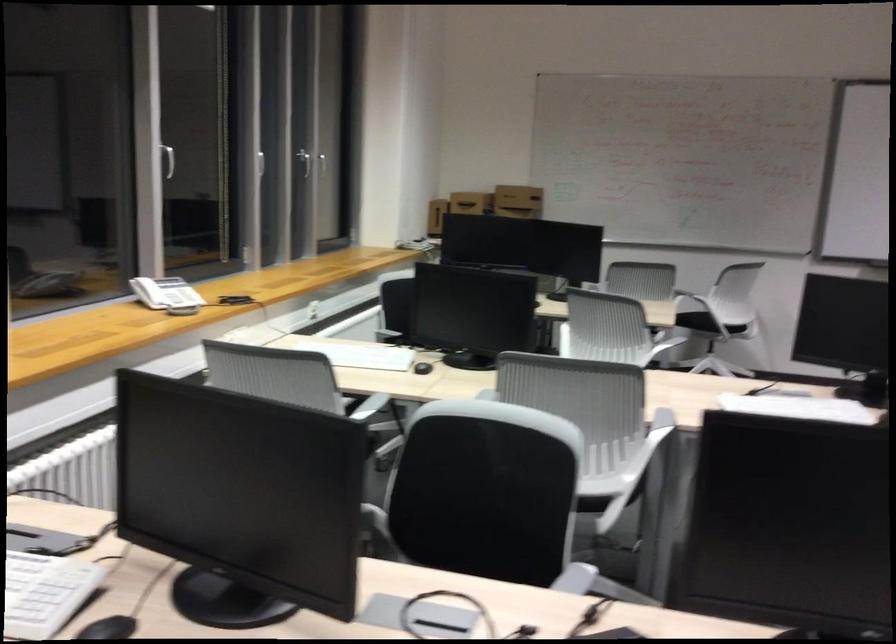
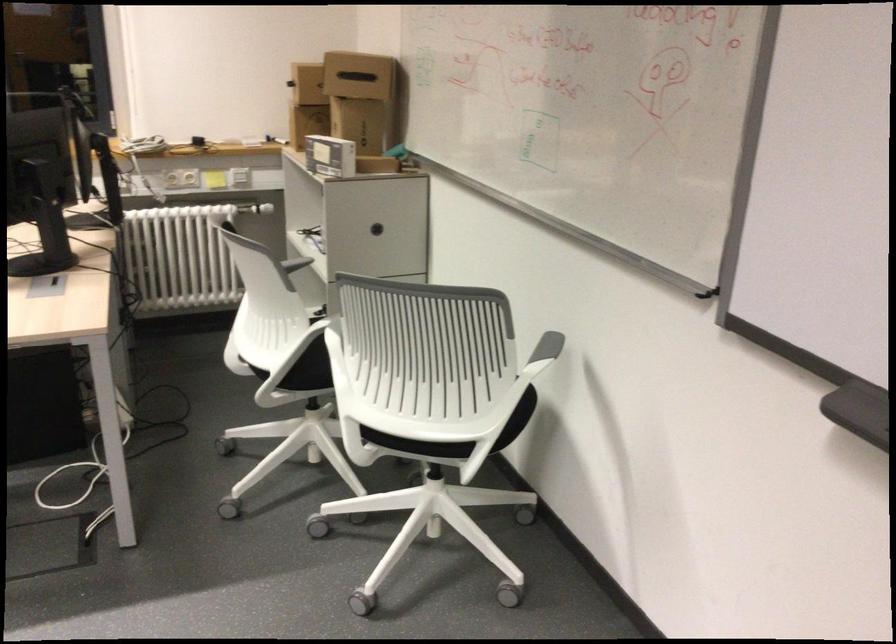
In the second image, find the point that corresponds to pixel 494 200 in the first image.

(307, 84)